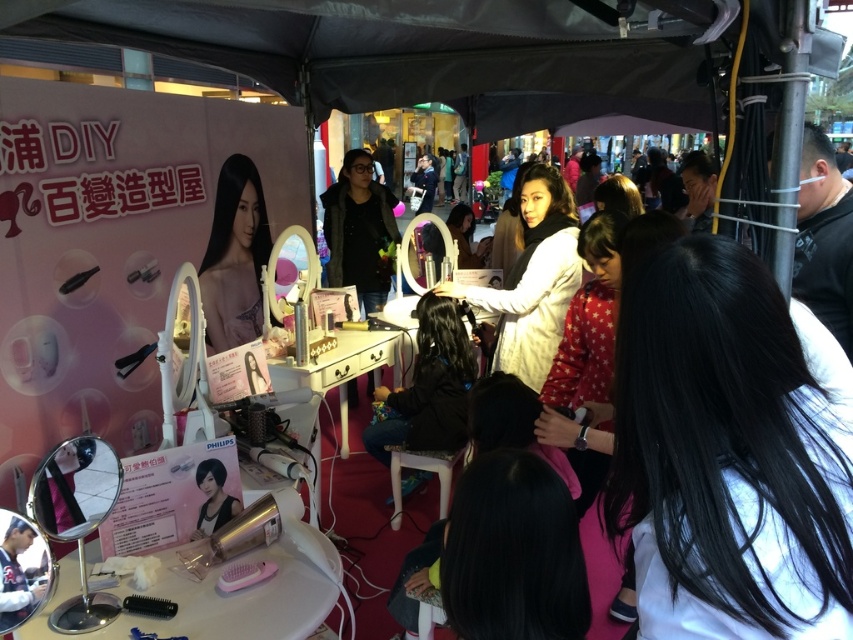
Question: Based on their relative distances, which object is nearer to the dark brown hair at center?

Choices:
 (A) black silky hair at center
 (B) white matte hairdresser at center
 (C) smooth black hair at center

Answer: (B)

Question: Which of these objects is positioned farthest from the dark brown hair at center?

Choices:
 (A) black silky hair at center
 (B) white matte hairdresser at center

Answer: (A)

Question: Among these points, which one is farthest from the camera?

Choices:
 (A) pyautogui.click(x=659, y=461)
 (B) pyautogui.click(x=451, y=420)
 (C) pyautogui.click(x=233, y=209)

Answer: (C)

Question: Is black silky hair at center thinner than white matte hairdresser at center?

Choices:
 (A) yes
 (B) no

Answer: (A)

Question: Does black silky hair at center have a larger size compared to smooth black hair at center?

Choices:
 (A) yes
 (B) no

Answer: (B)

Question: Can you confirm if dark brown hair at center is positioned to the right of smooth black hair at center?

Choices:
 (A) no
 (B) yes

Answer: (B)